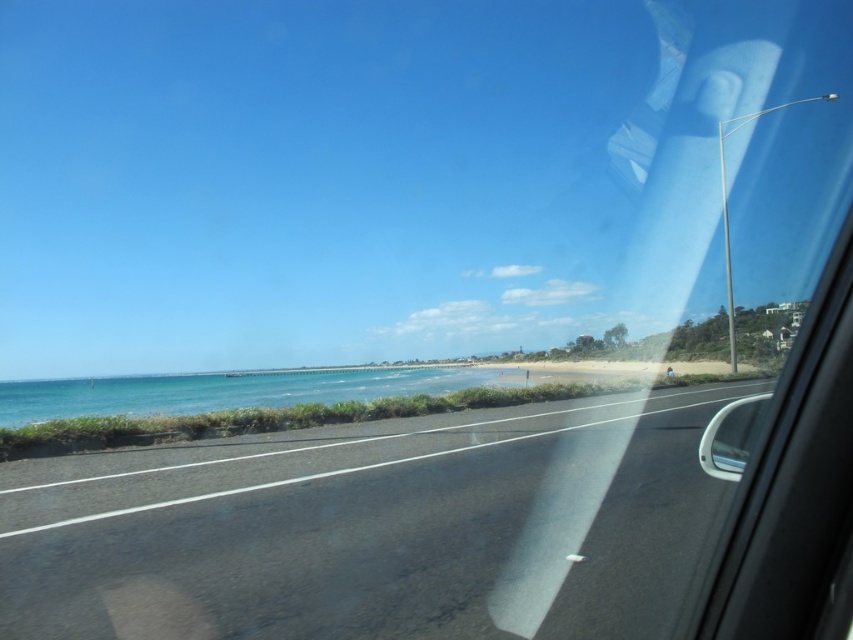
Question: Is black asphalt highway at center thinner than blue water at lower left?

Choices:
 (A) no
 (B) yes

Answer: (B)

Question: Which object is closer to the camera taking this photo?

Choices:
 (A) black asphalt highway at center
 (B) blue water at lower left

Answer: (A)

Question: From the image, what is the correct spatial relationship of black asphalt highway at center in relation to blue water at lower left?

Choices:
 (A) right
 (B) left

Answer: (A)

Question: Is black asphalt highway at center bigger than blue water at lower left?

Choices:
 (A) no
 (B) yes

Answer: (A)

Question: Among these points, which one is farthest from the camera?

Choices:
 (A) (450, 381)
 (B) (515, 467)

Answer: (A)